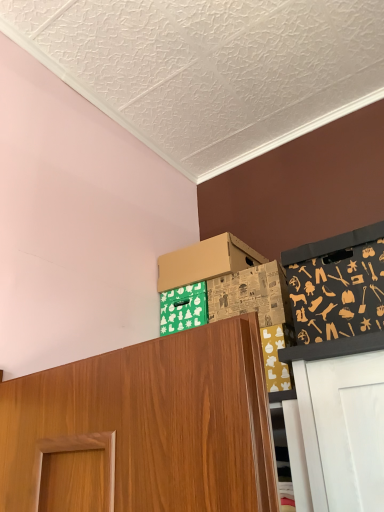
Question: In the image, is brown cardboard box at upper center, which ranks as the 2th box in front-to-back order, on the left side or the right side of black fabric with tool patterns at upper right?

Choices:
 (A) left
 (B) right

Answer: (A)

Question: Looking at their shapes, would you say brown cardboard box at upper center, arranged as the 1th box when viewed from the back, is wider or thinner than black fabric with tool patterns at upper right?

Choices:
 (A) thin
 (B) wide

Answer: (A)

Question: Considering the real-world distances, which object is farthest from the brown cardboard box at upper center, arranged as the 1th box when viewed from the back?

Choices:
 (A) cardboard box at upper center, the first box when ordered from front to back
 (B) black fabric with tool patterns at upper right

Answer: (B)

Question: Estimate the real-world distances between objects in this image. Which object is farther from the brown cardboard box at upper center, which ranks as the 2th box in front-to-back order?

Choices:
 (A) cardboard box at upper center, the first box when ordered from front to back
 (B) black fabric with tool patterns at upper right

Answer: (B)